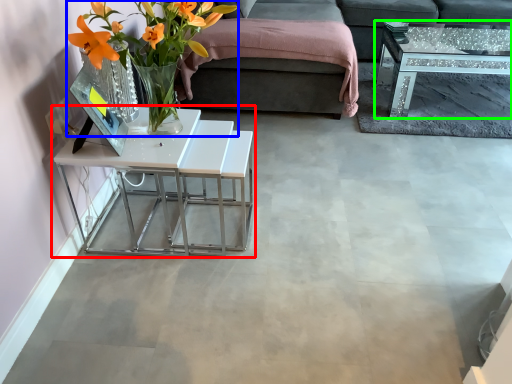
Question: Considering the real-world distances, which object is closest to table (highlighted by a red box)? floral arrangement (highlighted by a blue box) or coffee table (highlighted by a green box).

Choices:
 (A) floral arrangement
 (B) coffee table

Answer: (A)